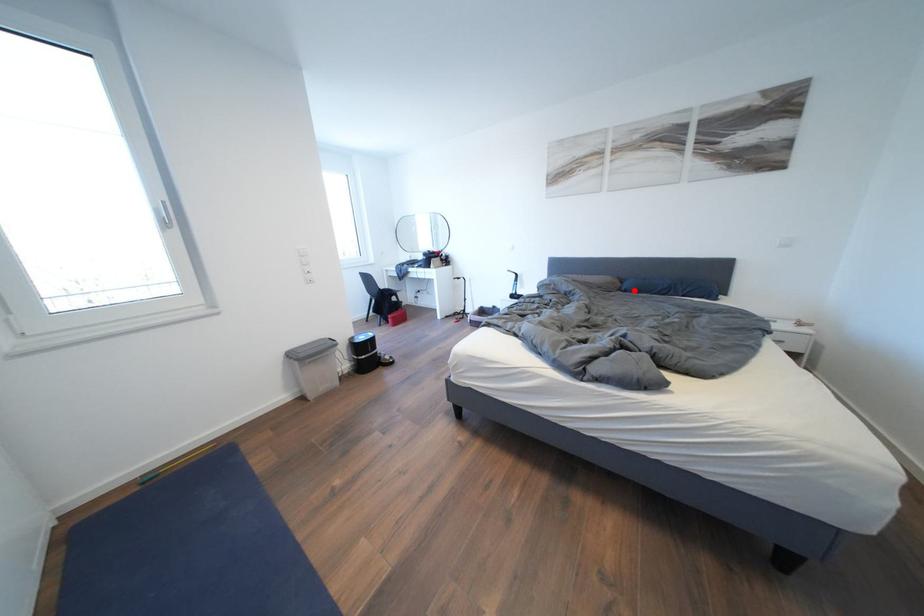
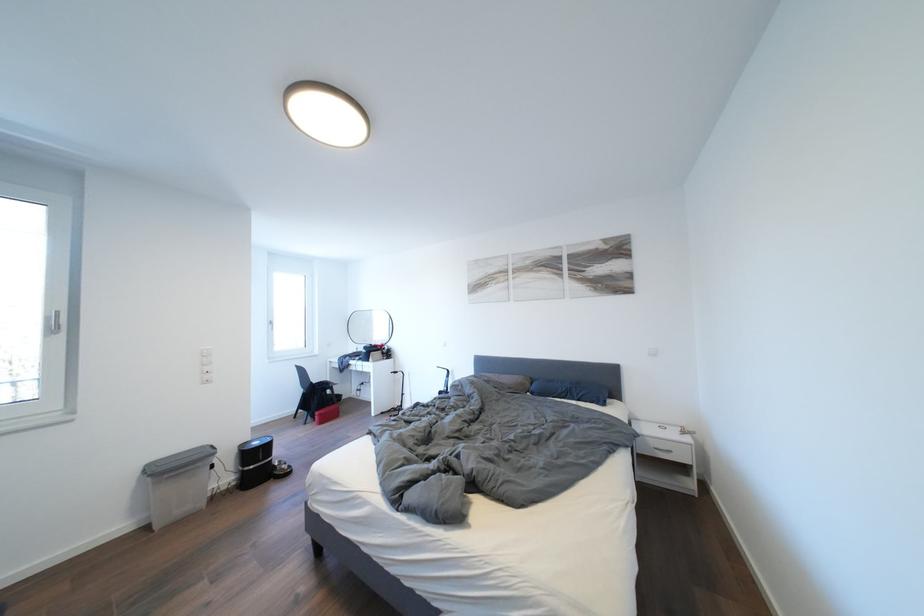
Find the pixel in the second image that matches the highlighted location in the first image.

(541, 392)